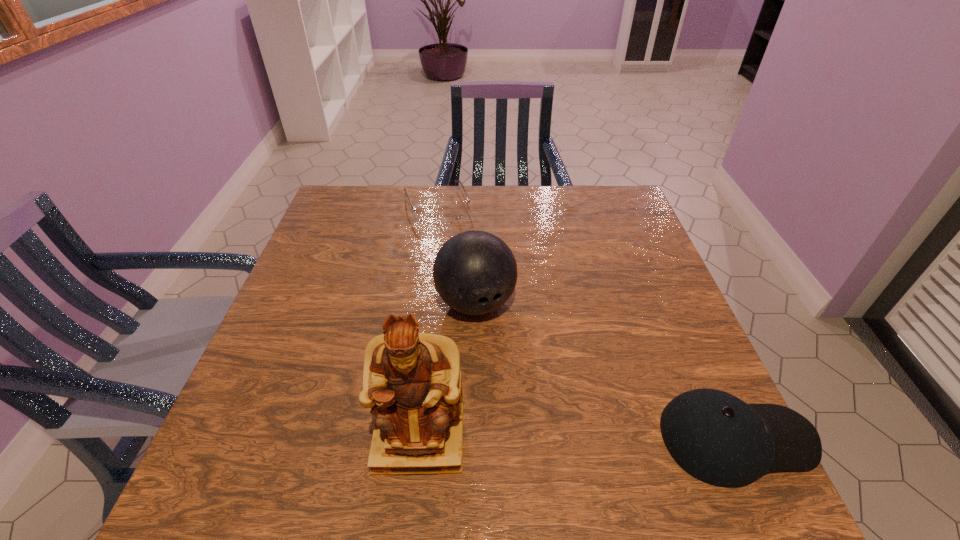
Identify the location of the tallest object. Image resolution: width=960 pixels, height=540 pixels. (412, 382).

At what (x,y) coordinates should I click in order to perform the action: click on the rightmost object. Please return your answer as a coordinate pair (x, y). Looking at the image, I should click on (717, 438).

Where is `baseball cap`? Image resolution: width=960 pixels, height=540 pixels. baseball cap is located at coordinates (717, 438).

Identify the location of the farthest object. (429, 214).

Where is `spectacles`? The image size is (960, 540). spectacles is located at coordinates (429, 214).

You are a GUI agent. You are given a task and a screenshot of the screen. Output one action in this format:
    pyautogui.click(x=<x>, y=<y>)
    Task: Click on the bowling ball
    The image size is (960, 540).
    Given the screenshot: What is the action you would take?
    pyautogui.click(x=475, y=272)

This screenshot has height=540, width=960. I want to click on the third shortest object, so click(475, 272).

Image resolution: width=960 pixels, height=540 pixels. In order to click on vacant space positioned on the front-facing side of the spectacles in this screenshot , I will do `click(468, 276)`.

Identify the location of vacant space located on the front-facing side of the spectacles. (468, 274).

Find the location of a particular element. vacant space located 0.290m on the front-facing side of the spectacles is located at coordinates (474, 289).